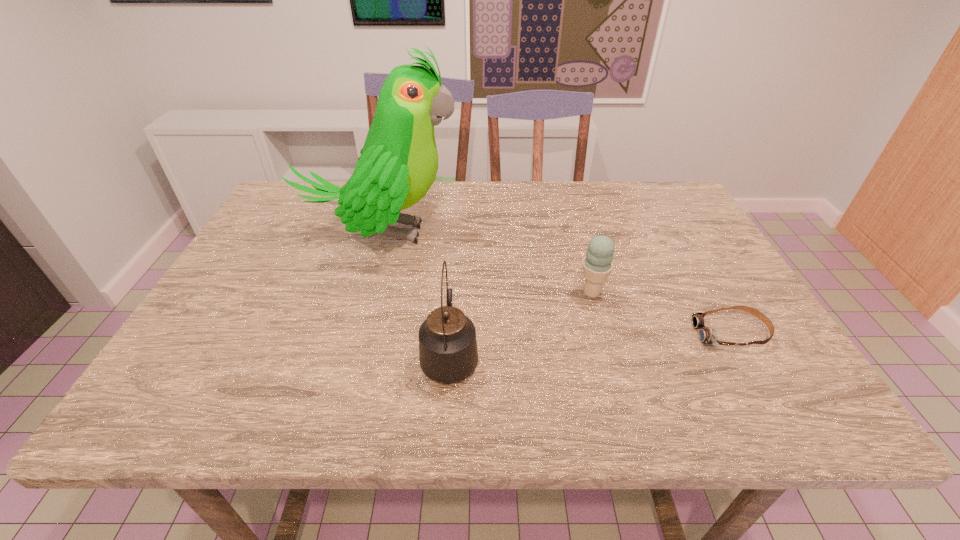
Image resolution: width=960 pixels, height=540 pixels. In order to click on vacant space at the far edge in this screenshot , I will do `click(576, 208)`.

I want to click on free space at the near edge of the desktop, so click(x=558, y=389).

Where is `vacant space at the left edge`? This screenshot has width=960, height=540. vacant space at the left edge is located at coordinates (269, 262).

Where is `vacant space at the right edge`? vacant space at the right edge is located at coordinates (679, 268).

You are a GUI agent. You are given a task and a screenshot of the screen. Output one action in this format:
    pyautogui.click(x=<x>, y=<y>)
    Task: Click on the free space at the near left corner of the desktop
    The width and height of the screenshot is (960, 540).
    Given the screenshot: What is the action you would take?
    pyautogui.click(x=204, y=382)

The image size is (960, 540). Find the location of `vacant space at the far right corner of the desktop`. vacant space at the far right corner of the desktop is located at coordinates (664, 210).

The image size is (960, 540). Identify the location of vacant region between the kettle and the second farthest object. (520, 324).

Where is `vacant space that's between the third shortest object and the shortest object`? This screenshot has width=960, height=540. vacant space that's between the third shortest object and the shortest object is located at coordinates pos(590,345).

At what (x,y) coordinates should I click in order to perform the action: click on free space between the rightmost object and the second tallest object. Please return your answer as a coordinate pair (x, y). The width and height of the screenshot is (960, 540). Looking at the image, I should click on [x=590, y=345].

Identify the location of vacant space in between the parakeet and the second tallest object. The image size is (960, 540). (416, 294).